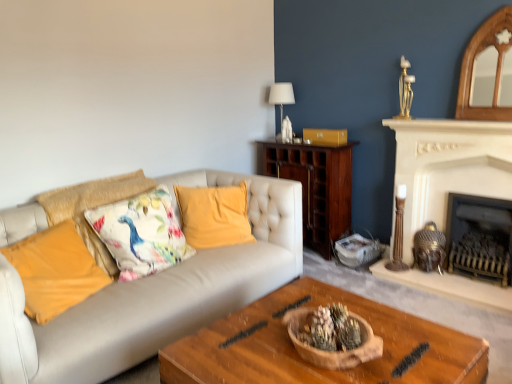
Question: Is floral fabric cushion at left, the third pillow when ordered from right to left, facing towards floral fabric cushion at center left, the 2th pillow viewed from the right?

Choices:
 (A) yes
 (B) no

Answer: (A)

Question: Does floral fabric cushion at left, the third pillow when ordered from right to left, have a greater width compared to floral fabric cushion at center left, the 2th pillow viewed from the right?

Choices:
 (A) yes
 (B) no

Answer: (A)

Question: Is floral fabric cushion at left, the third pillow when ordered from right to left, located outside floral fabric cushion at center left, the 2th pillow viewed from the right?

Choices:
 (A) yes
 (B) no

Answer: (B)

Question: From a real-world perspective, is floral fabric cushion at left, which is the second pillow in left-to-right order, on top of floral fabric cushion at center left, the 3th pillow in the left-to-right sequence?

Choices:
 (A) no
 (B) yes

Answer: (B)

Question: From the image's perspective, is floral fabric cushion at left, which is the second pillow in left-to-right order, beneath floral fabric cushion at center left, the 2th pillow viewed from the right?

Choices:
 (A) no
 (B) yes

Answer: (A)

Question: Is floral fabric cushion at left, the third pillow when ordered from right to left, positioned with its back to floral fabric cushion at center left, the 2th pillow viewed from the right?

Choices:
 (A) no
 (B) yes

Answer: (B)

Question: Is floral fabric cushion at center left, the 2th pillow viewed from the right, smaller than white stone fireplace at upper right, the second fireplace positioned from the right?

Choices:
 (A) no
 (B) yes

Answer: (A)

Question: Is floral fabric cushion at center left, the 3th pillow in the left-to-right sequence, positioned far away from white stone fireplace at upper right, the second fireplace positioned from the right?

Choices:
 (A) yes
 (B) no

Answer: (A)

Question: Would you say floral fabric cushion at center left, the 3th pillow in the left-to-right sequence, is outside white stone fireplace at upper right, placed as the first fireplace when sorted from left to right?

Choices:
 (A) yes
 (B) no

Answer: (A)

Question: Does floral fabric cushion at center left, the 3th pillow in the left-to-right sequence, have a lesser width compared to white stone fireplace at upper right, the second fireplace positioned from the right?

Choices:
 (A) no
 (B) yes

Answer: (A)

Question: From the image's perspective, is floral fabric cushion at center left, the 3th pillow in the left-to-right sequence, located beneath white stone fireplace at upper right, the second fireplace positioned from the right?

Choices:
 (A) yes
 (B) no

Answer: (A)

Question: From a real-world perspective, does floral fabric cushion at center left, the 2th pillow viewed from the right, sit lower than white stone fireplace at upper right, placed as the first fireplace when sorted from left to right?

Choices:
 (A) no
 (B) yes

Answer: (A)

Question: Is black metal fireplace at right, the second fireplace in the left-to-right sequence, oriented towards floral fabric cushion at center left, the 2th pillow viewed from the right?

Choices:
 (A) yes
 (B) no

Answer: (B)